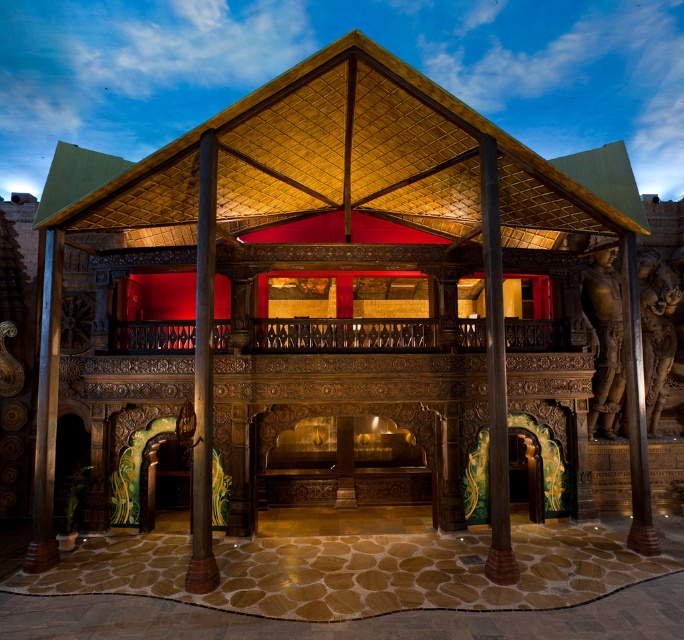
Can you confirm if gold textured canopy at center is positioned below wooden railing at center?

No.

Where is `gold textured canopy at center`? gold textured canopy at center is located at coordinates (x=345, y=163).

Who is more distant from viewer, (415,172) or (394,317)?

Positioned behind is point (394,317).

Locate an element on the screen. This screenshot has width=684, height=640. gold textured canopy at center is located at coordinates (345, 163).

Who is more forward, [591,410] or [200,236]?

Point [200,236]

Find the location of a particular element. The width and height of the screenshot is (684, 640). brown polished wood statue at right is located at coordinates (605, 342).

Measure the distance between wooden railing at center and brown polished wood statue at right.

wooden railing at center is 3.48 meters away from brown polished wood statue at right.

Is wooden railing at center thinner than brown polished wood statue at right?

No.

Is point (371, 332) positioned before point (663, 314)?

That is True.

Identify the location of wooden railing at center. The height and width of the screenshot is (640, 684). (343, 333).